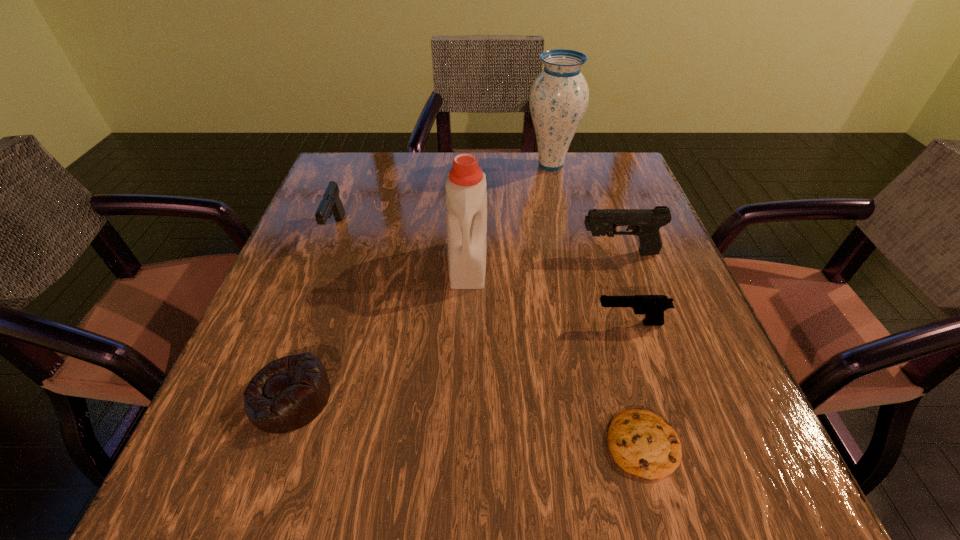
At what (x,y) coordinates should I click in order to perform the action: click on free point between the shortest pistol and the cookie. Please return your answer as a coordinate pair (x, y). This screenshot has width=960, height=540. Looking at the image, I should click on click(x=636, y=383).

I want to click on empty location between the vase and the farthest pistol, so click(444, 197).

Where is `vacant point located between the tallest pistol and the shortest pistol`? This screenshot has height=540, width=960. vacant point located between the tallest pistol and the shortest pistol is located at coordinates (625, 288).

You are a GUI agent. You are given a task and a screenshot of the screen. Output one action in this format:
    pyautogui.click(x=<x>, y=<y>)
    Task: Click on the free point between the detergent and the leftmost pistol
    
    Given the screenshot: What is the action you would take?
    pyautogui.click(x=402, y=247)

Identify the location of vacant point located between the shortest object and the leftmost pistol. (490, 336).

This screenshot has height=540, width=960. Find the location of `free space between the cookie and the fifth shortest object`. free space between the cookie and the fifth shortest object is located at coordinates (631, 348).

This screenshot has height=540, width=960. What are the coordinates of `the fifth closest object to the second shortest object` in the screenshot? It's located at (645, 223).

Select which object appears as the fourth closest to the farthest pistol. Please provide its 2D coordinates. Your answer should be formatted as a tuple, i.e. [(x, y)], where the tuple contains the x and y coordinates of a point satisfying the conditions above.

[(645, 223)]

Locate which pistol ranks second in proximity to the second nearest pistol. Please provide its 2D coordinates. Your answer should be formatted as a tuple, i.e. [(x, y)], where the tuple contains the x and y coordinates of a point satisfying the conditions above.

[(331, 204)]

Identify the location of pistol that is the third closest to the second shortest object. This screenshot has width=960, height=540. (645, 223).